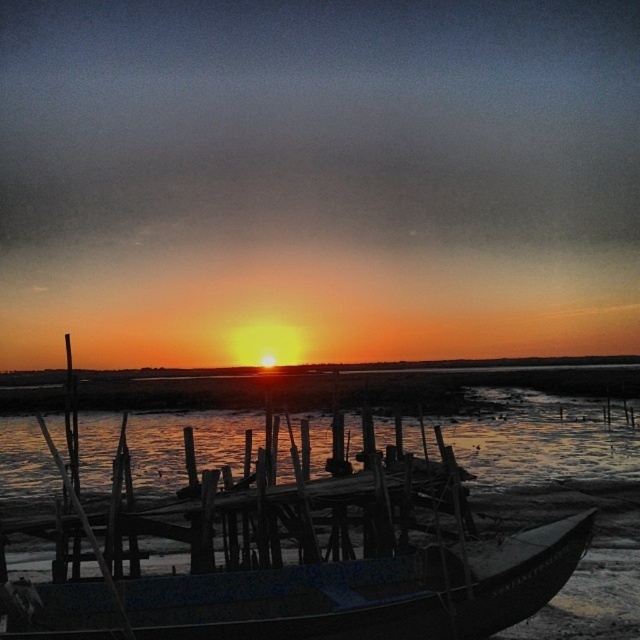
Question: Estimate the real-world distances between objects in this image. Which object is farther from the wooden at center?

Choices:
 (A) translucent water at center
 (B) blue painted wood boat at lower center

Answer: (A)

Question: Which point is closer to the camera?

Choices:
 (A) (198, 596)
 (B) (570, 424)

Answer: (A)

Question: Does translucent water at center have a greater width compared to wooden at center?

Choices:
 (A) no
 (B) yes

Answer: (B)

Question: Can you confirm if blue painted wood boat at lower center is bigger than wooden at center?

Choices:
 (A) yes
 (B) no

Answer: (A)

Question: Can you confirm if blue painted wood boat at lower center is wider than wooden at center?

Choices:
 (A) no
 (B) yes

Answer: (B)

Question: Among these objects, which one is nearest to the camera?

Choices:
 (A) wooden at center
 (B) translucent water at center
 (C) blue painted wood boat at lower center

Answer: (C)